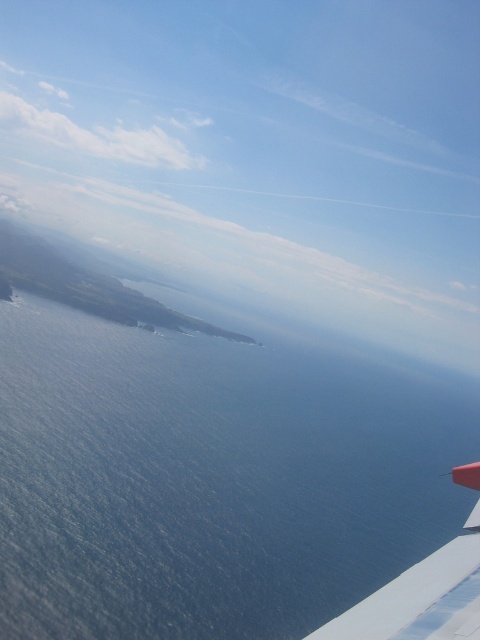
Question: Where is blue water at lower left located in relation to white matte wing at lower right in the image?

Choices:
 (A) above
 (B) below

Answer: (B)

Question: Is blue water at lower left bigger than white matte wing at lower right?

Choices:
 (A) no
 (B) yes

Answer: (B)

Question: Is blue water at lower left below white matte wing at lower right?

Choices:
 (A) yes
 (B) no

Answer: (A)

Question: Among these points, which one is nearest to the camera?

Choices:
 (A) (92, 609)
 (B) (455, 474)

Answer: (B)

Question: Among these points, which one is farthest from the camera?

Choices:
 (A) (415, 625)
 (B) (276, 378)

Answer: (B)

Question: Which object is closer to the camera taking this photo?

Choices:
 (A) blue water at lower left
 (B) white matte wing at lower right

Answer: (B)